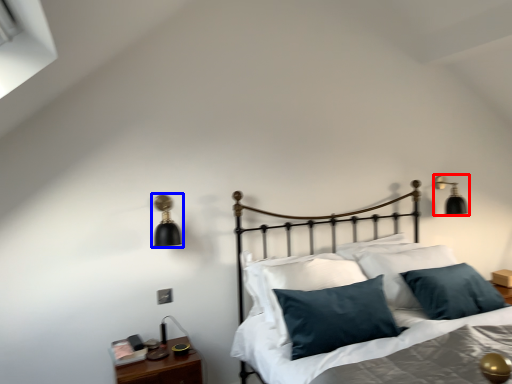
Question: Among these objects, which one is farthest to the camera, lamp (highlighted by a red box) or lamp (highlighted by a blue box)?

Choices:
 (A) lamp
 (B) lamp

Answer: (A)